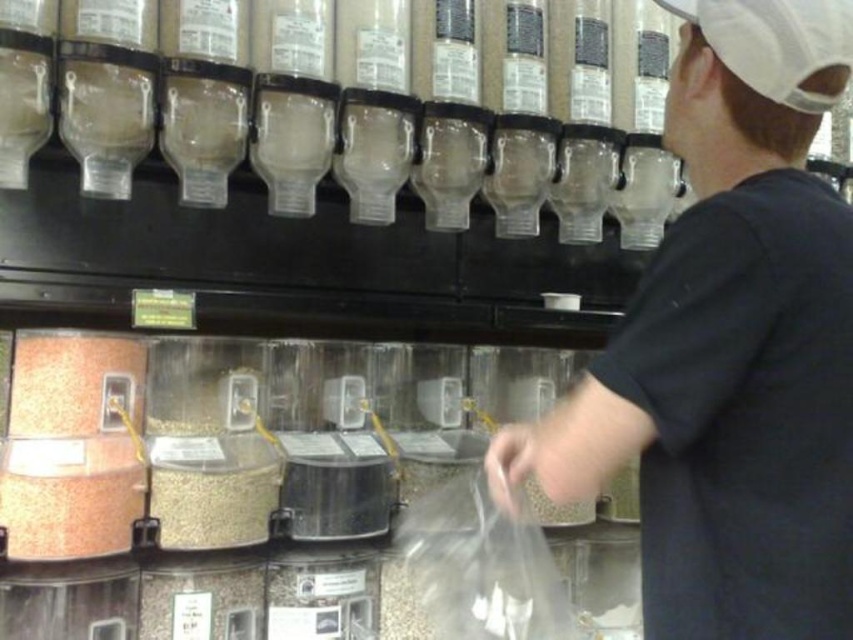
Question: Which point is closer to the camera taking this photo?

Choices:
 (A) (811, 173)
 (B) (218, 528)

Answer: (A)

Question: Is black matte shirt at center smaller than matte orange powder at lower left?

Choices:
 (A) yes
 (B) no

Answer: (B)

Question: Does black matte shirt at center have a greater width compared to matte orange powder at lower left?

Choices:
 (A) yes
 (B) no

Answer: (A)

Question: Which object appears farthest from the camera in this image?

Choices:
 (A) matte orange powder at lower left
 (B) gray matte grain at center
 (C) black matte shirt at center

Answer: (A)

Question: Which object appears closest to the camera in this image?

Choices:
 (A) gray matte grain at center
 (B) black matte shirt at center
 (C) matte orange powder at lower left

Answer: (B)

Question: Can you confirm if matte orange powder at lower left is positioned to the left of gray matte grain at center?

Choices:
 (A) no
 (B) yes

Answer: (B)